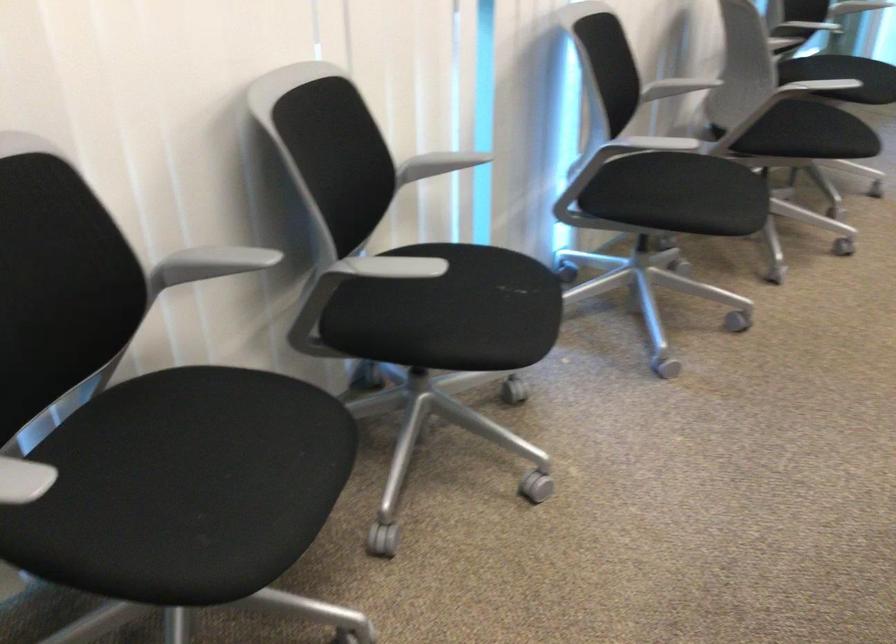
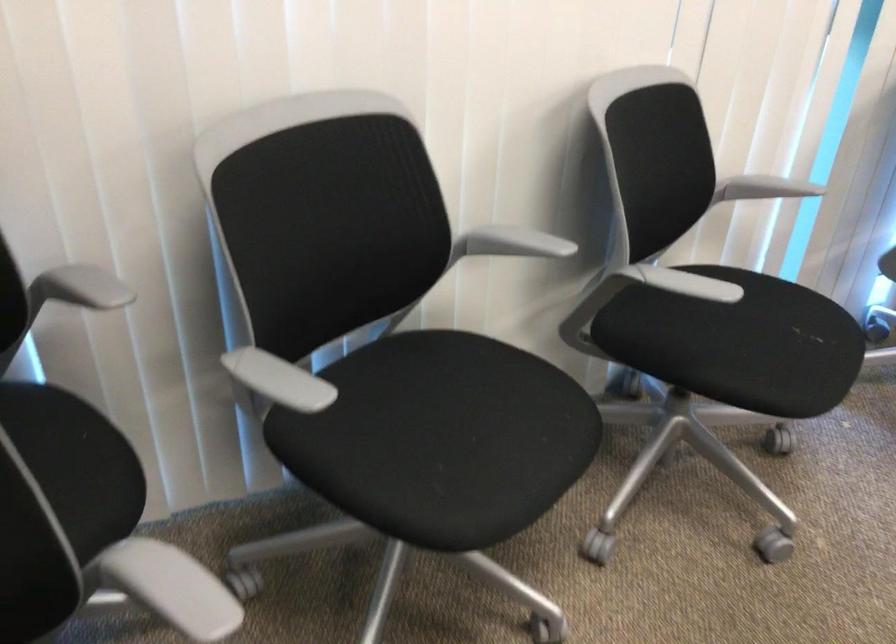
Question: In a continuous first-person perspective shot, in which direction is the camera moving?

Choices:
 (A) Left
 (B) Right
 (C) Forward
 (D) Backward

Answer: (B)